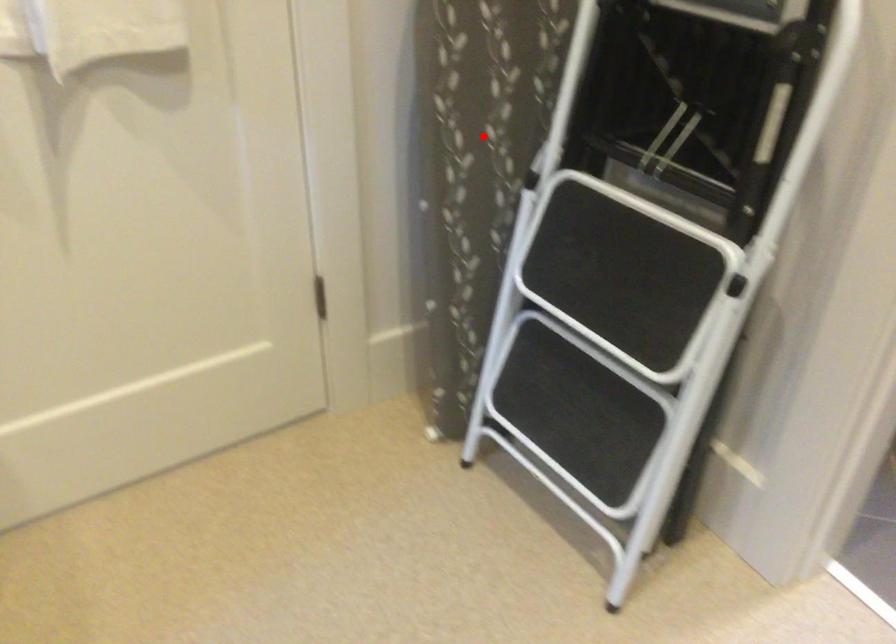
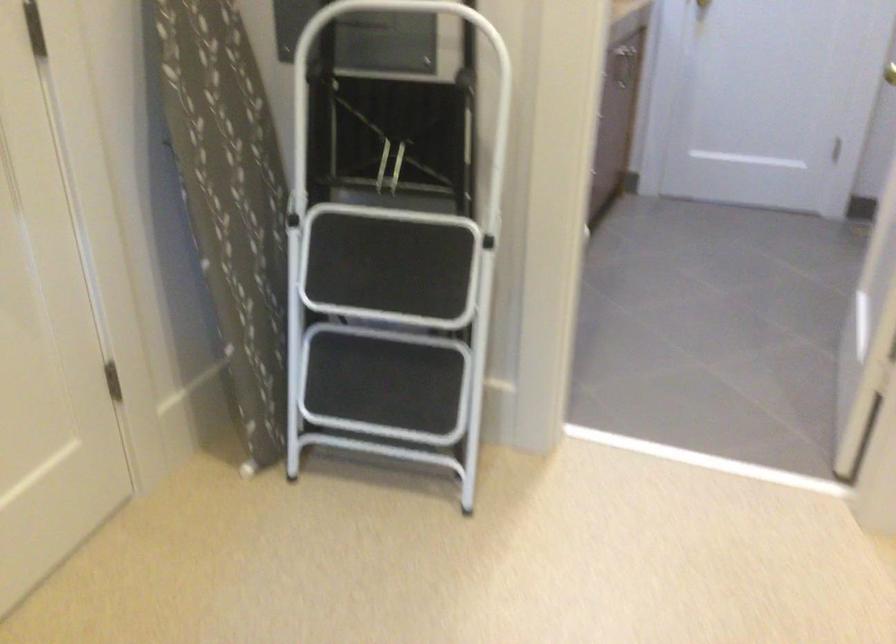
In the second image, find the point that corresponds to the highlighted location in the first image.

(229, 199)